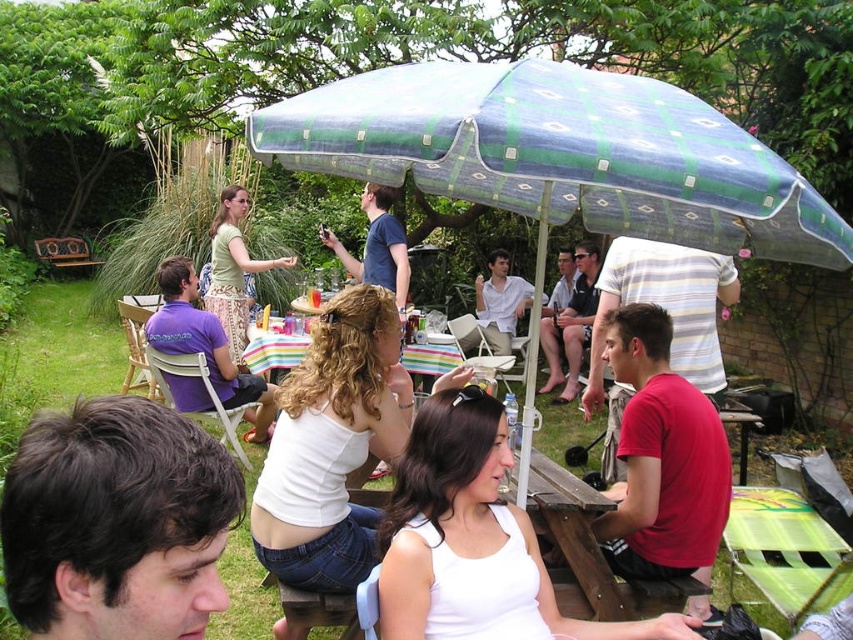
Question: Observing the image, what is the correct spatial positioning of purple cotton shirt at left in reference to matte blue shirt at center?

Choices:
 (A) below
 (B) above

Answer: (A)

Question: Which object is positioned farthest from the purple cotton shirt at left?

Choices:
 (A) red matte shirt at lower right
 (B) matte blue shirt at center

Answer: (A)

Question: Among these objects, which one is farthest from the camera?

Choices:
 (A) dark brown hair at center
 (B) matte green shirt at center

Answer: (B)

Question: Does dark brown hair at center have a smaller size compared to matte blue shirt at center?

Choices:
 (A) no
 (B) yes

Answer: (B)

Question: Which point is farther from the camera taking this photo?

Choices:
 (A) (694, 490)
 (B) (260, 397)

Answer: (B)

Question: Does dark brown hair at center come in front of matte blue shirt at center?

Choices:
 (A) no
 (B) yes

Answer: (B)